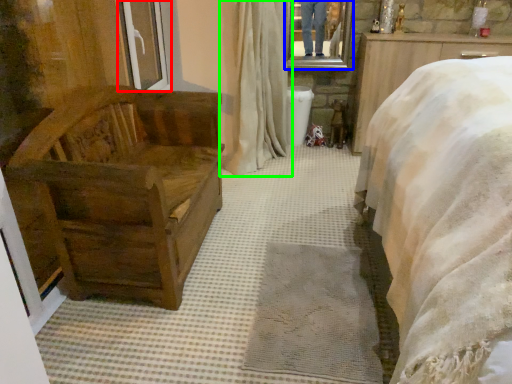
Question: Which object is the closest to the window frame (highlighted by a red box)? Choose among these: mirror (highlighted by a blue box) or curtain (highlighted by a green box).

Choices:
 (A) mirror
 (B) curtain

Answer: (B)